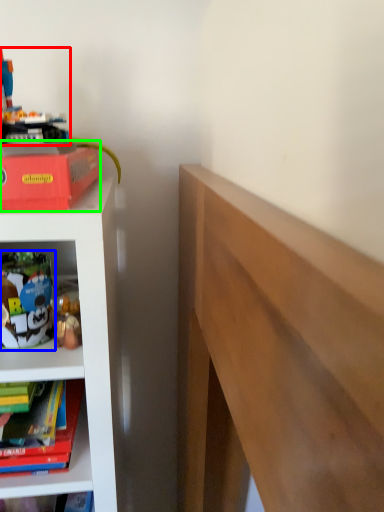
Question: Estimate the real-world distances between objects in this image. Which object is closer to toy (highlighted by a red box), toy (highlighted by a blue box) or paperback book (highlighted by a green box)?

Choices:
 (A) toy
 (B) paperback book

Answer: (B)